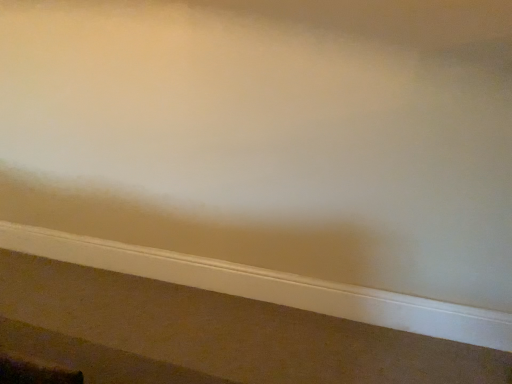
I want to click on white smooth baseboard at bottom, so click(x=269, y=286).

What do you see at coordinates (269, 286) in the screenshot?
I see `white smooth baseboard at bottom` at bounding box center [269, 286].

What is the approximate width of white smooth baseboard at bottom?

The width of white smooth baseboard at bottom is 2.00 inches.

This screenshot has height=384, width=512. In order to click on white smooth baseboard at bottom in this screenshot , I will do `click(269, 286)`.